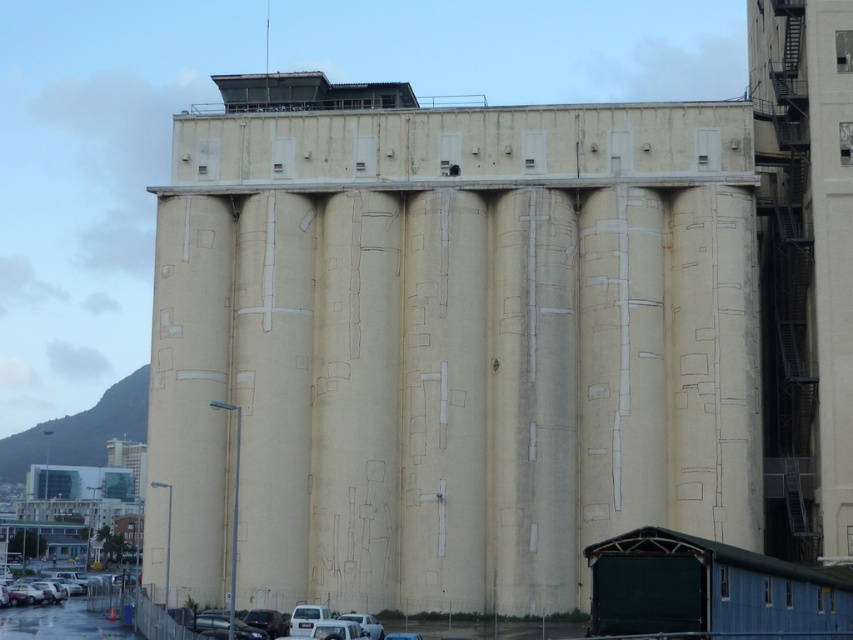
You are standing at a safe distance from the beige concrete silo at center. If you want to take a photo of it with your smartphone, which has a standard 12MP camera sensor, will you need to zoom in or can you capture the entire structure without zooming?

The beige concrete silo at center is 263.56 feet away from the camera. Since standard smartphones have a wide enough angle to capture large structures at such distances without zooming, you can capture the entire structure without zooming.

You are standing in front of the industrial silo and see two points marked on its surface. The first point is at coordinates point (239, 483) and the second is at point (131, 595). Which point is closer to you?

Point (239, 483) is in front of point (131, 595), so it is closer to you.